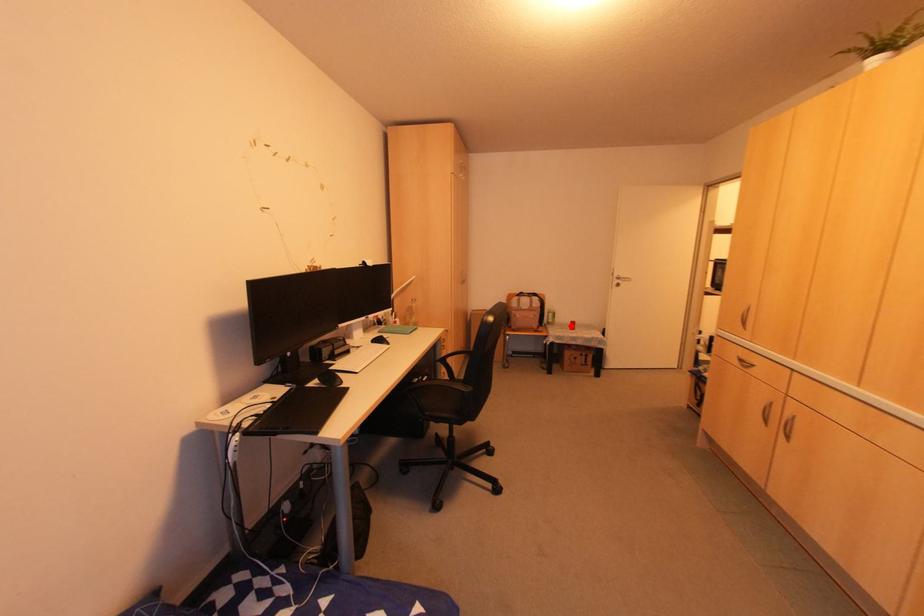
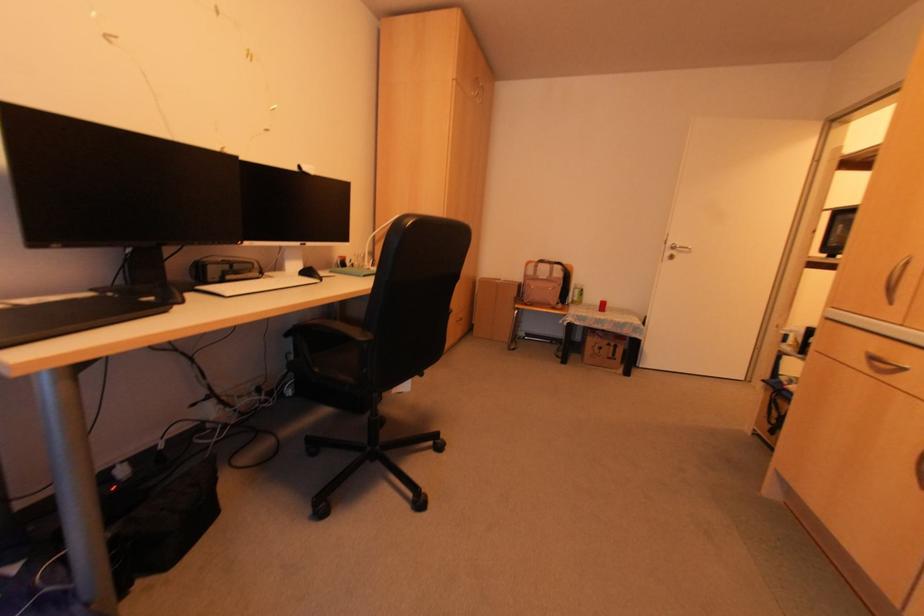
The point at the highlighted location is marked in the first image. Where is the corresponding point in the second image?

(601, 307)